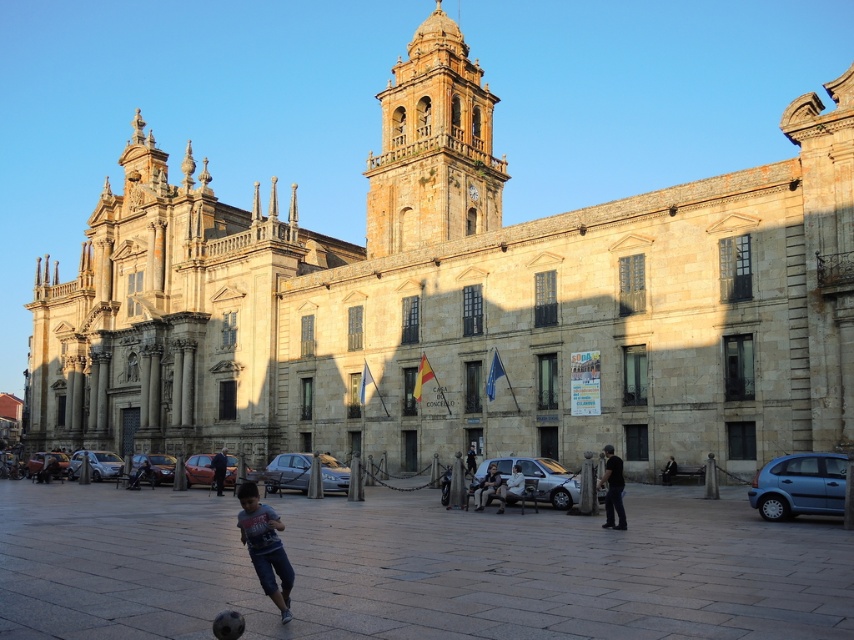
Question: Which object is the farthest from the dark brown leather jacket at center?

Choices:
 (A) smooth stone pavement at center
 (B) dark blue jeans at center
 (C) blue cotton shirt at center

Answer: (C)

Question: Which object is farther from the camera taking this photo?

Choices:
 (A) dark blue jeans at center
 (B) blue cotton shirt at center
 (C) light blue denim jeans at center
 (D) dark brown leather jacket at center

Answer: (A)

Question: From the image, what is the correct spatial relationship of dark brown leather jacket at center in relation to dark blue jeans at center?

Choices:
 (A) left
 (B) right

Answer: (B)

Question: Is blue cotton shirt at center above light blue denim jeans at center?

Choices:
 (A) yes
 (B) no

Answer: (A)

Question: Does blue cotton shirt at center have a lesser width compared to dark brown leather jacket at center?

Choices:
 (A) yes
 (B) no

Answer: (B)

Question: Which point appears farthest from the camera in this image?

Choices:
 (A) (518, 467)
 (B) (278, 552)
 (C) (619, 497)
 (D) (209, 609)

Answer: (A)